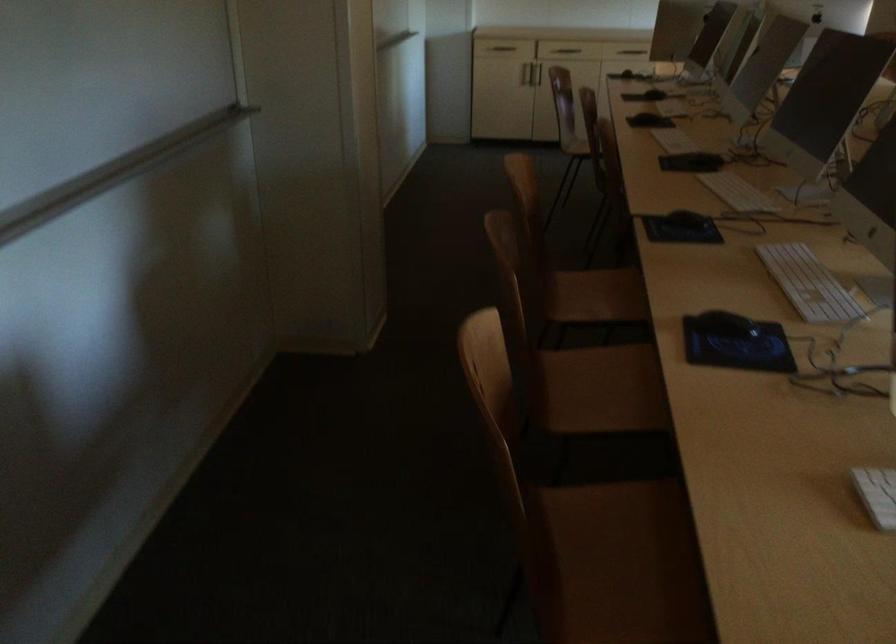
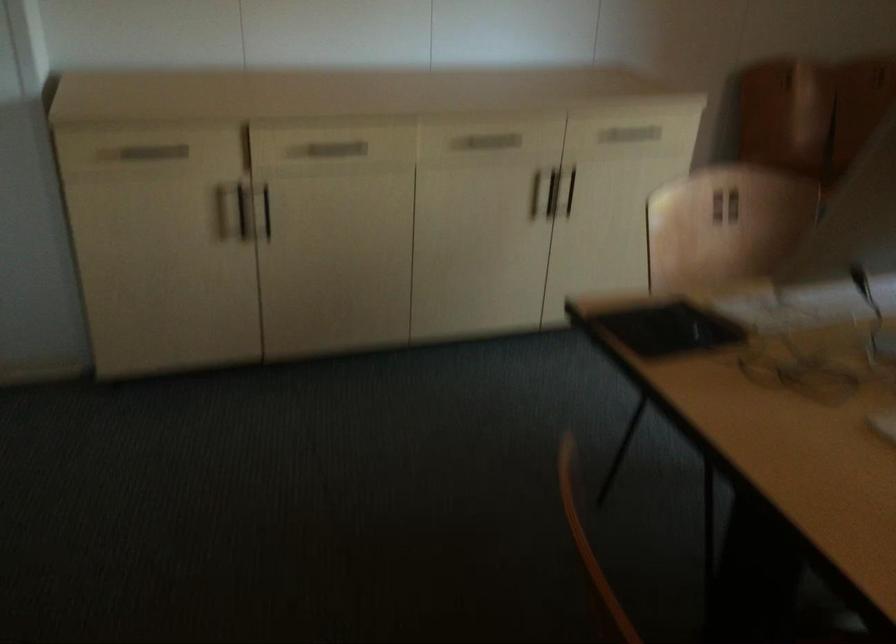
Question: The images are taken continuously from a first-person perspective. In which direction are you moving?

Choices:
 (A) Left
 (B) Right
 (C) Forward
 (D) Backward

Answer: (C)